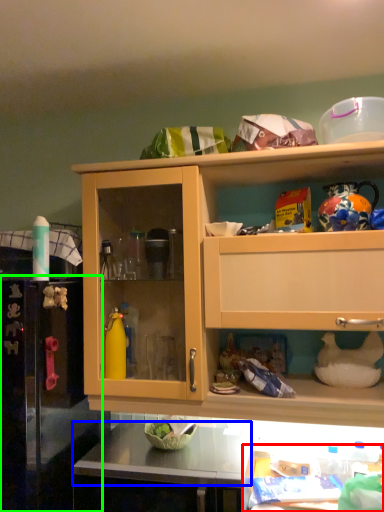
Question: Which object is the farthest from table (highlighted by a red box)? Choose among these: counter top (highlighted by a blue box) or appliance (highlighted by a green box).

Choices:
 (A) counter top
 (B) appliance

Answer: (B)